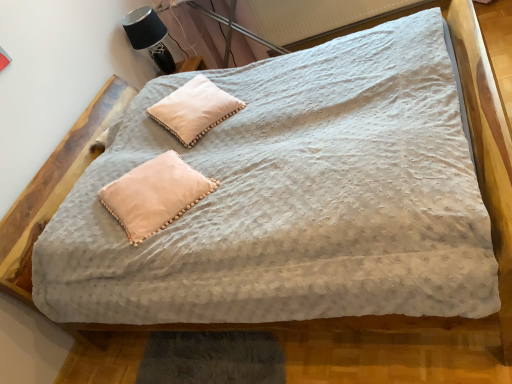
Question: Can you confirm if black fabric table lamp at upper left is wider than pale pink fabric pillow at center, acting as the 1th pillow starting from the bottom?

Choices:
 (A) no
 (B) yes

Answer: (A)

Question: Can you confirm if black fabric table lamp at upper left is bigger than pale pink fabric pillow at center, the 1th pillow in the front-to-back sequence?

Choices:
 (A) yes
 (B) no

Answer: (A)

Question: From a real-world perspective, is black fabric table lamp at upper left located higher than pale pink fabric pillow at center, acting as the 1th pillow starting from the bottom?

Choices:
 (A) yes
 (B) no

Answer: (A)

Question: Does black fabric table lamp at upper left have a lesser width compared to pale pink fabric pillow at center, acting as the 1th pillow starting from the bottom?

Choices:
 (A) yes
 (B) no

Answer: (A)

Question: Is pale pink fabric pillow at center, positioned as the second pillow in back-to-front order, a part of black fabric table lamp at upper left?

Choices:
 (A) no
 (B) yes

Answer: (A)

Question: From the image's perspective, relative to white textured radiator at upper center, is black fabric table lamp at upper left above or below?

Choices:
 (A) below
 (B) above

Answer: (A)

Question: Is black fabric table lamp at upper left situated inside white textured radiator at upper center or outside?

Choices:
 (A) inside
 (B) outside

Answer: (B)

Question: Would you say black fabric table lamp at upper left is to the left or to the right of white textured radiator at upper center in the picture?

Choices:
 (A) right
 (B) left

Answer: (B)

Question: From a real-world perspective, is black fabric table lamp at upper left positioned above or below white textured radiator at upper center?

Choices:
 (A) above
 (B) below

Answer: (A)

Question: Does point (200, 107) appear closer or farther from the camera than point (387, 6)?

Choices:
 (A) farther
 (B) closer

Answer: (B)

Question: Which is correct: white soft pillow at upper center, the second pillow positioned from the bottom, is inside white textured radiator at upper center, or outside of it?

Choices:
 (A) outside
 (B) inside

Answer: (A)

Question: Considering the positions of white soft pillow at upper center, the 1th pillow in the top-to-bottom sequence, and white textured radiator at upper center in the image, is white soft pillow at upper center, the 1th pillow in the top-to-bottom sequence, taller or shorter than white textured radiator at upper center?

Choices:
 (A) tall
 (B) short

Answer: (B)

Question: Looking at their shapes, would you say white soft pillow at upper center, the second pillow positioned from the bottom, is wider or thinner than white textured radiator at upper center?

Choices:
 (A) thin
 (B) wide

Answer: (B)

Question: Does point pos(381,1) appear closer or farther from the camera than point pos(124,16)?

Choices:
 (A) farther
 (B) closer

Answer: (A)

Question: Relative to black fabric table lamp at upper left, is white textured radiator at upper center in front or behind?

Choices:
 (A) behind
 (B) front

Answer: (B)